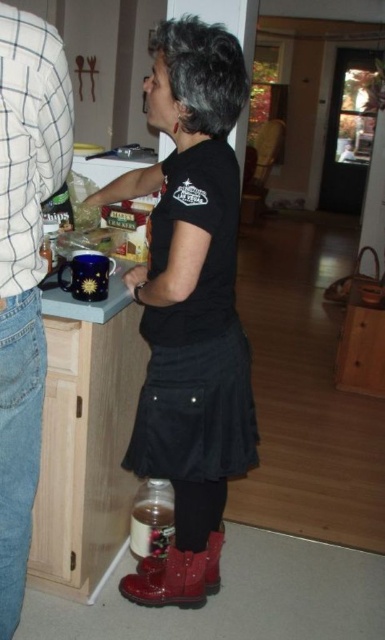
Does shiny patent leather boots at lower center appear over denim jeans at left?

Indeed, shiny patent leather boots at lower center is positioned over denim jeans at left.

Which is below, shiny patent leather boots at lower center or denim jeans at left?

denim jeans at left

Measure the distance between shiny patent leather boots at lower center and camera.

The distance of shiny patent leather boots at lower center from camera is 4.41 feet.

The height and width of the screenshot is (640, 385). In order to click on shiny patent leather boots at lower center in this screenshot , I will do `click(190, 307)`.